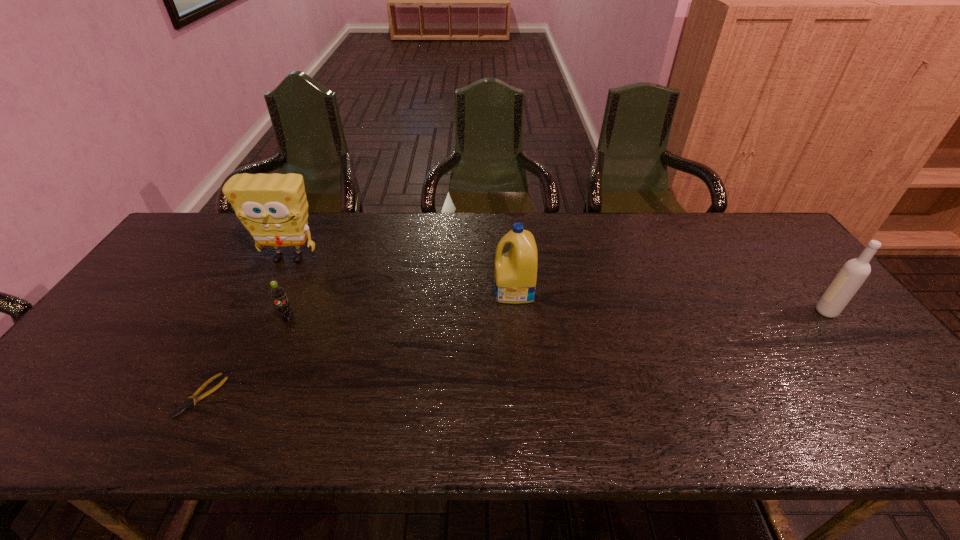
Where is `the farthest object`? The image size is (960, 540). the farthest object is located at coordinates (273, 207).

Locate an element on the screen. vodka is located at coordinates (854, 272).

Locate an element on the screen. This screenshot has width=960, height=540. the second object from right to left is located at coordinates (515, 272).

Identify the location of soda. The height and width of the screenshot is (540, 960). (277, 293).

In order to click on the shortest object in this screenshot , I will do `click(189, 402)`.

At what (x,y) coordinates should I click in order to perform the action: click on pliers. Please return your answer as a coordinate pair (x, y). The height and width of the screenshot is (540, 960). Looking at the image, I should click on (189, 402).

Locate an element on the screen. Image resolution: width=960 pixels, height=540 pixels. vacant region located 0.200m on the face of the farthest object is located at coordinates (258, 320).

This screenshot has height=540, width=960. What are the coordinates of `blank space located 0.170m on the front of the rightmost object` in the screenshot? It's located at (875, 372).

Identify the location of vacant space located 0.140m on the label of the detergent. This screenshot has width=960, height=540. (444, 291).

The height and width of the screenshot is (540, 960). In order to click on blank area located on the label of the detergent in this screenshot , I will do `click(374, 291)`.